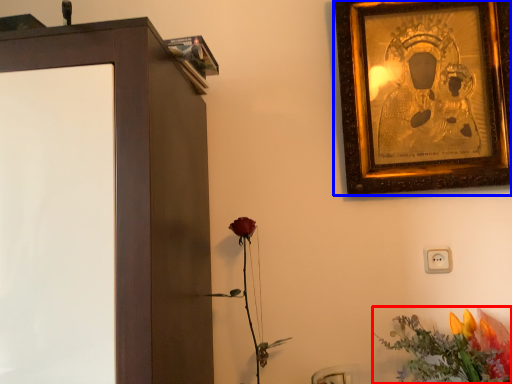
Question: Which object is further to the camera taking this photo, flower (highlighted by a red box) or picture frame (highlighted by a blue box)?

Choices:
 (A) flower
 (B) picture frame

Answer: (B)